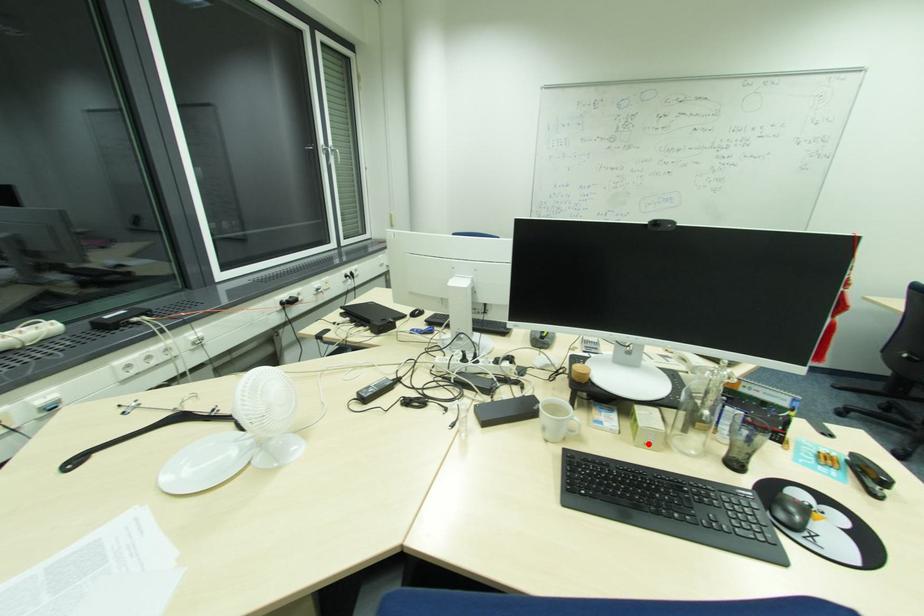
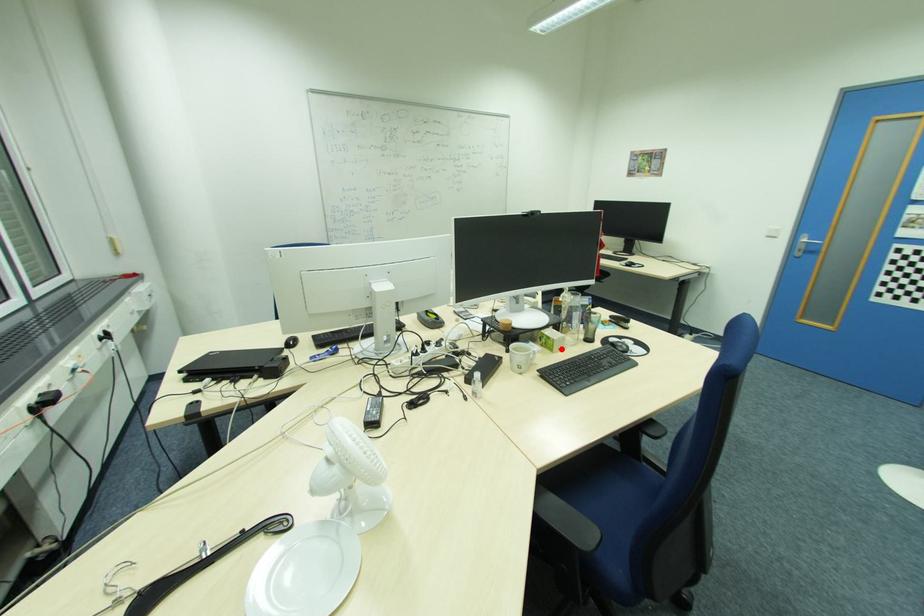
I am providing you with two images of the same scene from different viewpoints. A red point is marked on the first image and another point is marked on the second image. Is the red point in image1 aligned with the point shown in image2?

Yes